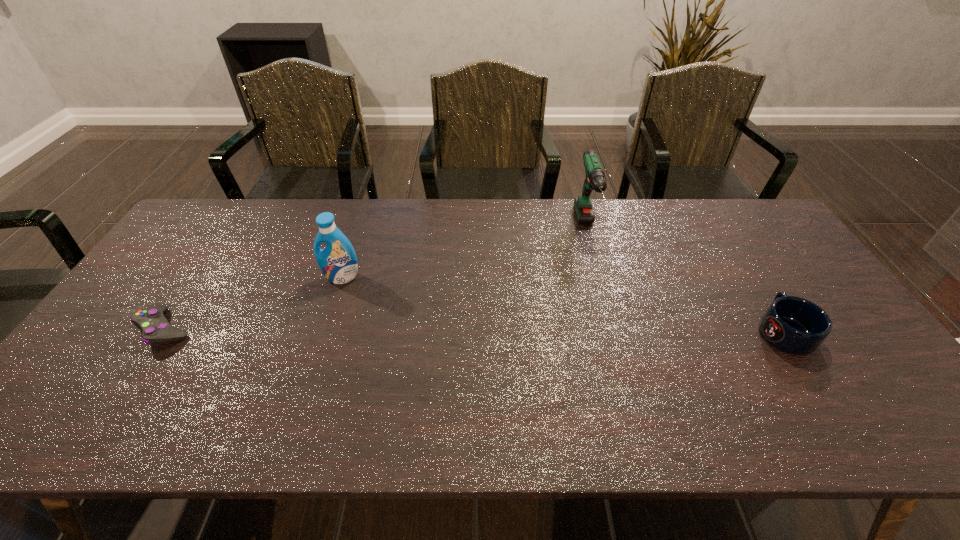
At what (x,y) coordinates should I click in order to perform the action: click on the third object from left to right. Please return your answer as a coordinate pair (x, y). Image resolution: width=960 pixels, height=540 pixels. Looking at the image, I should click on (595, 179).

Identify the location of the farthest object. (595, 179).

At what (x,y) coordinates should I click in order to perform the action: click on detergent. Please return your answer as a coordinate pair (x, y). Looking at the image, I should click on (337, 261).

Image resolution: width=960 pixels, height=540 pixels. I want to click on the second farthest object, so click(337, 261).

Where is `mug`? mug is located at coordinates (794, 325).

This screenshot has width=960, height=540. I want to click on the rightmost object, so click(x=794, y=325).

Locate an element on the screen. This screenshot has height=540, width=960. the leftmost object is located at coordinates (155, 328).

Identify the location of control. The image size is (960, 540). (155, 328).

This screenshot has height=540, width=960. Identify the location of free space located on the handle side of the second object from right to left. (607, 298).

The image size is (960, 540). Find the location of `vacant area situated on the front-facing side of the third nearest object`. vacant area situated on the front-facing side of the third nearest object is located at coordinates (335, 299).